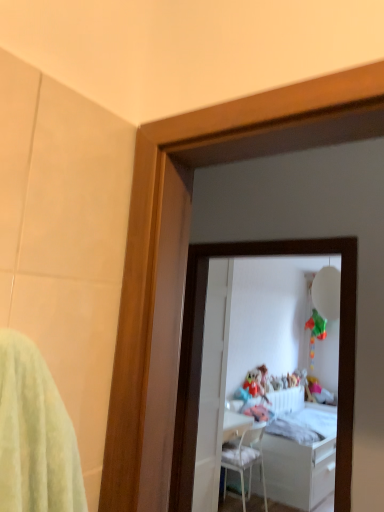
Question: From the image's perspective, is white glossy mirror at center on white glossy door at center?

Choices:
 (A) no
 (B) yes

Answer: (B)

Question: From a real-world perspective, is white glossy mirror at center physically below white glossy door at center?

Choices:
 (A) no
 (B) yes

Answer: (A)

Question: Does white glossy mirror at center have a larger size compared to white glossy door at center?

Choices:
 (A) yes
 (B) no

Answer: (A)

Question: Is white glossy mirror at center closer to the viewer compared to white glossy door at center?

Choices:
 (A) yes
 (B) no

Answer: (A)

Question: Considering the relative sizes of white glossy mirror at center and white glossy door at center in the image provided, is white glossy mirror at center taller than white glossy door at center?

Choices:
 (A) yes
 (B) no

Answer: (B)

Question: Can you confirm if white glossy mirror at center is wider than white glossy door at center?

Choices:
 (A) yes
 (B) no

Answer: (A)

Question: Is white glossy mirror at center positioned far away from white glossy bed at center?

Choices:
 (A) yes
 (B) no

Answer: (B)

Question: Is white glossy mirror at center looking in the opposite direction of white glossy bed at center?

Choices:
 (A) no
 (B) yes

Answer: (B)

Question: Considering the relative sizes of white glossy mirror at center and white glossy bed at center in the image provided, is white glossy mirror at center thinner than white glossy bed at center?

Choices:
 (A) no
 (B) yes

Answer: (B)

Question: Does white glossy mirror at center appear on the left side of white glossy bed at center?

Choices:
 (A) no
 (B) yes

Answer: (B)

Question: Is white glossy mirror at center not inside white glossy bed at center?

Choices:
 (A) no
 (B) yes

Answer: (B)

Question: Is white glossy mirror at center in front of white glossy bed at center?

Choices:
 (A) no
 (B) yes

Answer: (B)

Question: Can you see white glossy bed at center touching white glossy door at center?

Choices:
 (A) yes
 (B) no

Answer: (B)